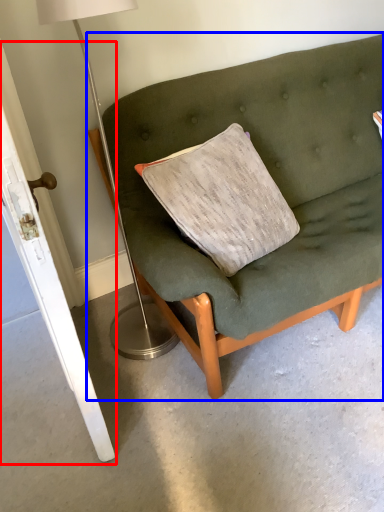
Question: Among these objects, which one is nearest to the camera, door (highlighted by a red box) or studio couch (highlighted by a blue box)?

Choices:
 (A) door
 (B) studio couch

Answer: (A)